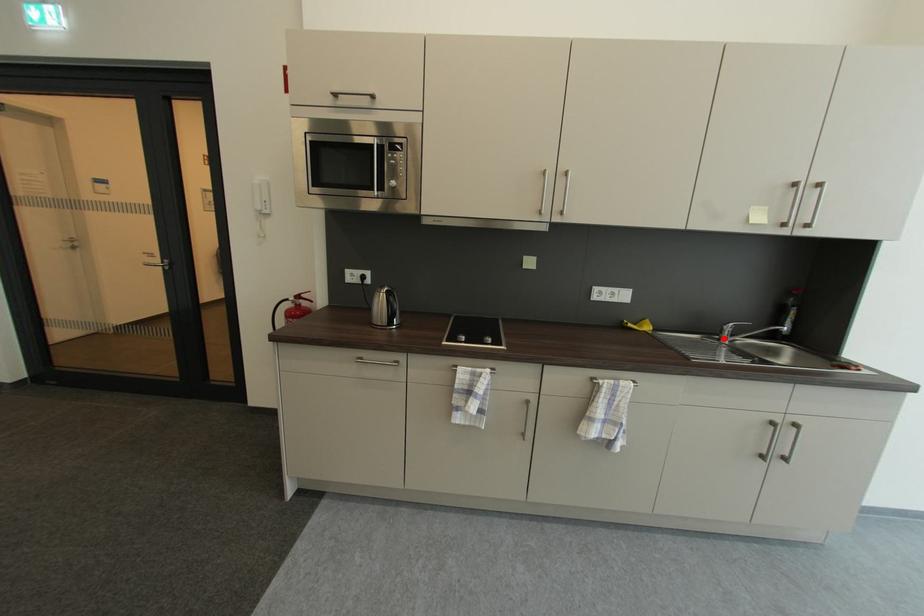
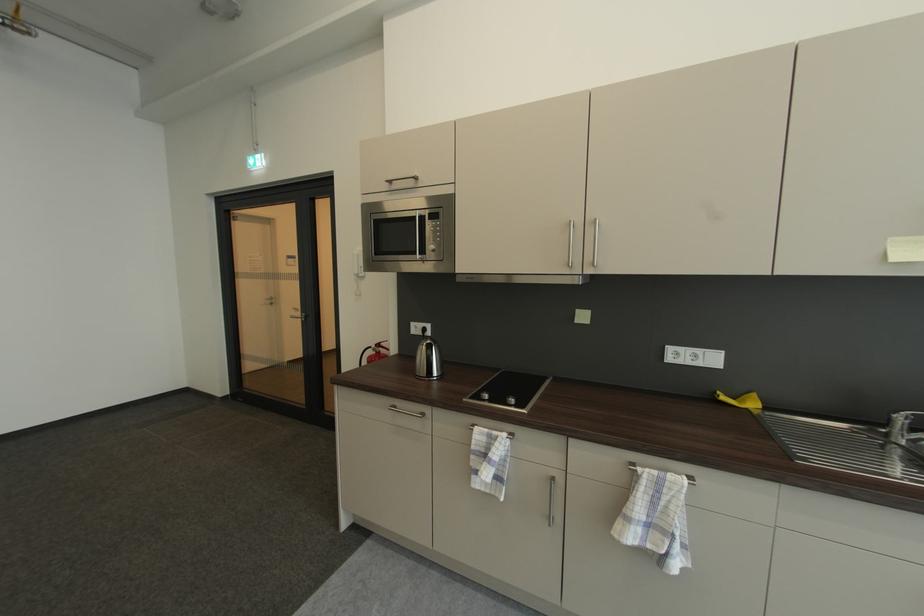
Locate, in the second image, the point that corresponds to the highlighted location in the first image.

(892, 432)